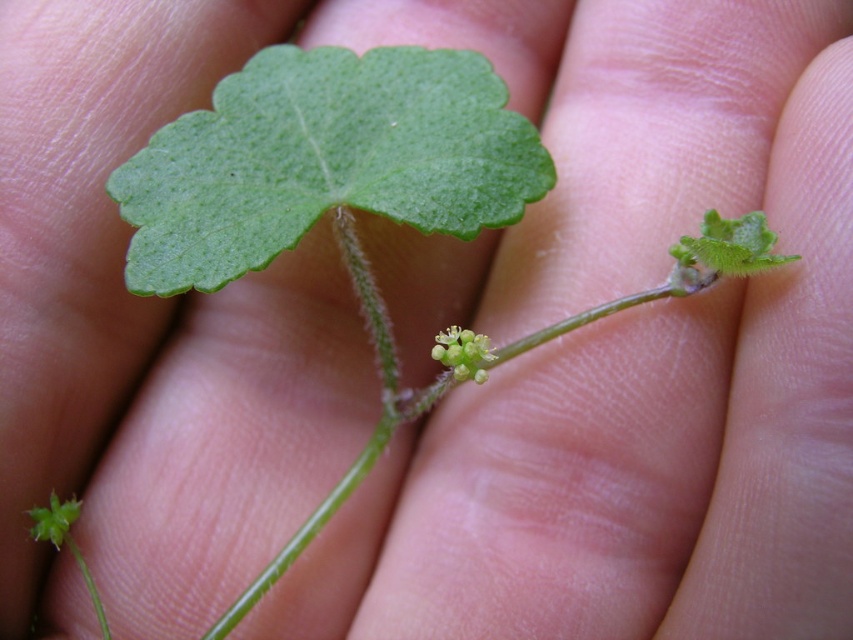
Question: From the image, what is the correct spatial relationship of green matte leaf at center in relation to green matte flower at center?

Choices:
 (A) above
 (B) below

Answer: (A)

Question: Can you confirm if green matte leaf at center is positioned above green matte flower at center?

Choices:
 (A) no
 (B) yes

Answer: (B)

Question: Is green matte leaf at center closer to camera compared to green matte flower at center?

Choices:
 (A) no
 (B) yes

Answer: (A)

Question: Which object is farther from the camera taking this photo?

Choices:
 (A) green matte flower at center
 (B) green matte leaf at center

Answer: (B)

Question: Among these points, which one is nearest to the camera?

Choices:
 (A) (491, 80)
 (B) (468, 356)

Answer: (B)